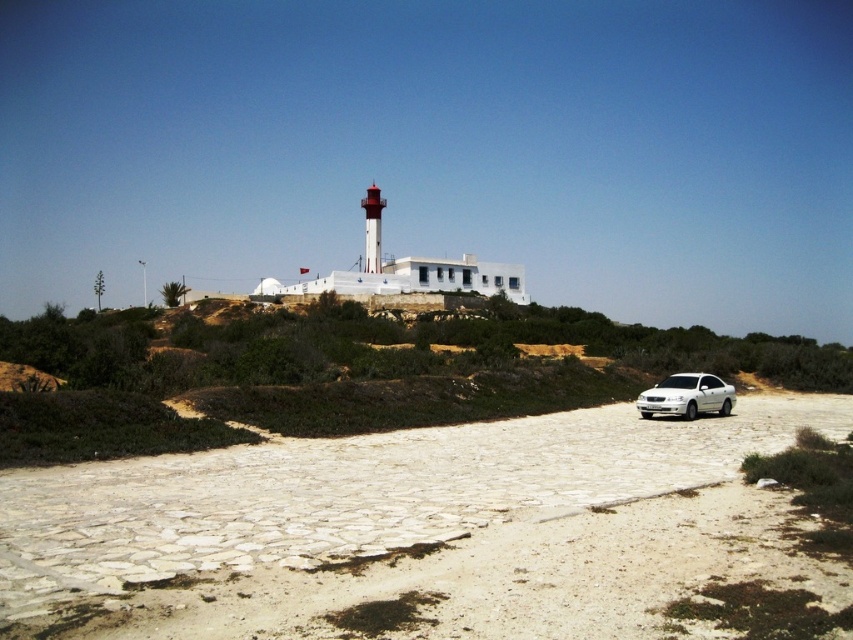
Question: Which point is farther from the camera taking this photo?

Choices:
 (A) (705, 456)
 (B) (221, 417)
 (C) (648, 408)

Answer: (C)

Question: Is white gravel road at center to the right of white metallic car at lower right from the viewer's perspective?

Choices:
 (A) no
 (B) yes

Answer: (A)

Question: Considering the real-world distances, which object is farthest from the white stone car at center?

Choices:
 (A) white metallic car at lower right
 (B) white gravel road at center

Answer: (A)

Question: Can you confirm if white gravel road at center is positioned below white metallic car at lower right?

Choices:
 (A) yes
 (B) no

Answer: (A)

Question: Estimate the real-world distances between objects in this image. Which object is closer to the white metallic car at lower right?

Choices:
 (A) white gravel road at center
 (B) white stone car at center

Answer: (A)

Question: Observing the image, what is the correct spatial positioning of white gravel road at center in reference to white stone car at center?

Choices:
 (A) above
 (B) below

Answer: (B)